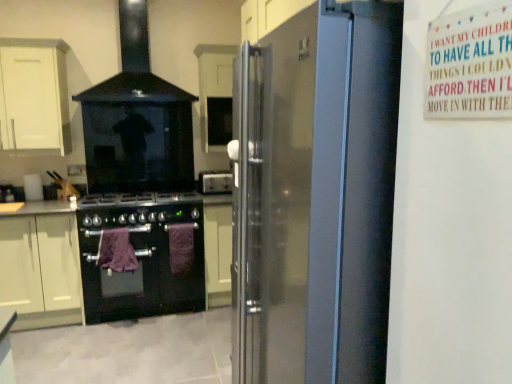
Question: In the image, is white matte cabinet at center, arranged as the 3th cabinetry when viewed from the left, positioned in front of or behind satin black refrigerator at right?

Choices:
 (A) front
 (B) behind

Answer: (B)

Question: From a real-world perspective, relative to satin black refrigerator at right, is white matte cabinet at center, which is the first cabinetry from right to left, vertically above or below?

Choices:
 (A) below
 (B) above

Answer: (B)

Question: Which object is positioned farthest from the satin silver toaster at center?

Choices:
 (A) purple towel at center, which is the 2th blanket in right-to-left order
 (B) matte white cabinet at lower left, acting as the 3th cabinetry starting from the right
 (C) white matte cabinet at upper left, which ranks as the 2th cabinetry in right-to-left order
 (D) purple towel at center, the 1th blanket in the right-to-left sequence
 (E) black matte gas stove at center

Answer: (C)

Question: Which object is the farthest from the purple towel at center, which is the 2th blanket in right-to-left order?

Choices:
 (A) satin black refrigerator at right
 (B) white matte cabinet at upper left, arranged as the second cabinetry when viewed from the left
 (C) satin silver toaster at center
 (D) black glass stove at upper center
 (E) black glass stove at center

Answer: (A)